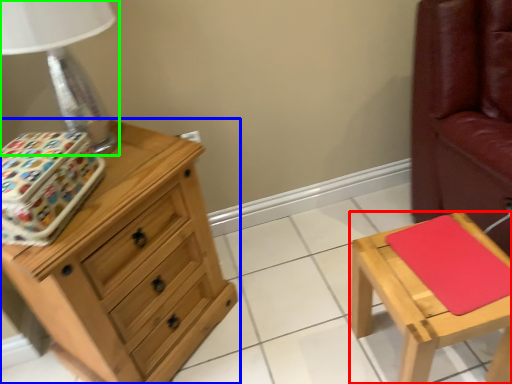
Question: Based on their relative distances, which object is farther from stool (highlighted by a red box)? Choose from chest of drawers (highlighted by a blue box) and table lamp (highlighted by a green box).

Choices:
 (A) chest of drawers
 (B) table lamp

Answer: (B)